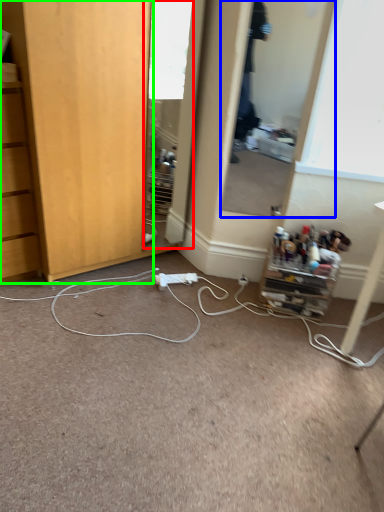
Question: Which is farther away from mirror (highlighted by a red box)? mirror (highlighted by a blue box) or cabinetry (highlighted by a green box)?

Choices:
 (A) mirror
 (B) cabinetry

Answer: (B)